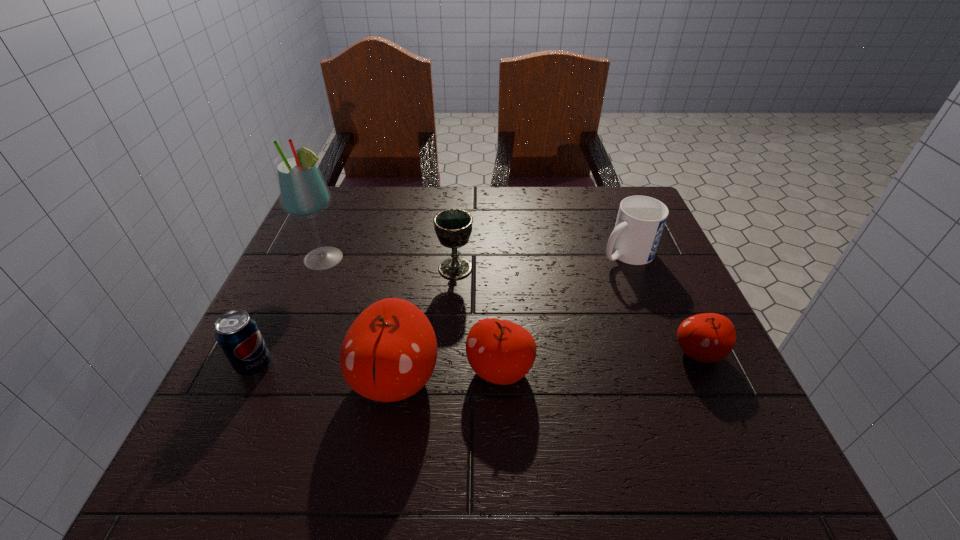
What are the coordinates of `free space located on the back of the second apple from right to left` in the screenshot? It's located at (495, 256).

Where is `vacant point located 0.170m on the left of the shortest object`? This screenshot has height=540, width=960. vacant point located 0.170m on the left of the shortest object is located at coordinates point(583,353).

I want to click on blank space located on the front of the mug, so click(683, 399).

I want to click on free space located 0.360m on the right of the chalice, so click(629, 268).

This screenshot has height=540, width=960. In order to click on vacant space located 0.250m on the right of the soda can in this screenshot , I will do `click(407, 364)`.

Image resolution: width=960 pixels, height=540 pixels. Identify the location of vacant space situated on the back of the alcohol. (347, 207).

This screenshot has height=540, width=960. In order to click on soda can that is at the near edge in this screenshot , I will do `click(238, 334)`.

At what (x,y) coordinates should I click in order to perform the action: click on soda can situated at the left edge. Please return your answer as a coordinate pair (x, y). Looking at the image, I should click on (238, 334).

I want to click on alcohol present at the left edge, so click(x=302, y=190).

The height and width of the screenshot is (540, 960). I want to click on apple that is at the right edge, so click(709, 337).